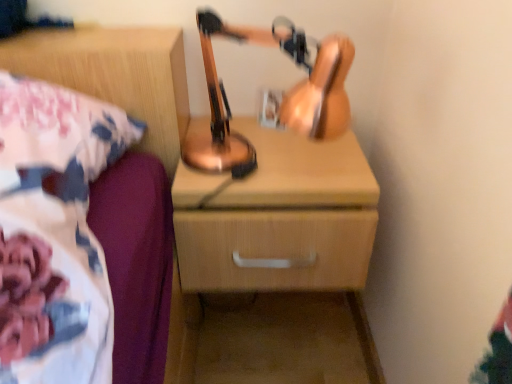
Locate an element on the screen. The width and height of the screenshot is (512, 384). blank space situated above wooden chest of drawers at center (from a real-world perspective) is located at coordinates (274, 157).